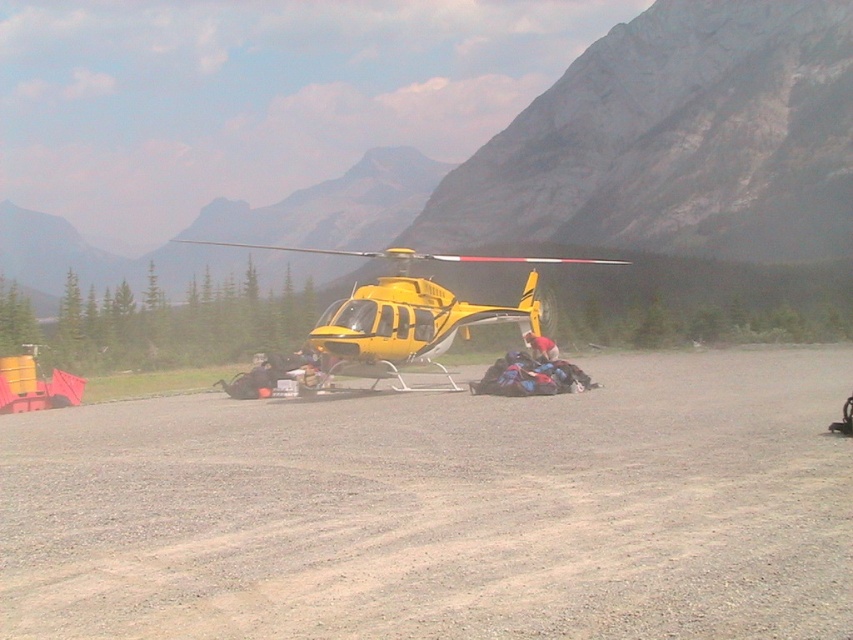
Measure the distance between gray gravel dirt track at center and camera.

They are 4.22 meters apart.

Which is in front, point (679, 525) or point (534, 356)?

Positioned in front is point (679, 525).

Identify the location of gray gravel dirt track at center. (444, 509).

Does rocky mountain at center have a greater height compared to red fabric bag at center?

Correct, rocky mountain at center is much taller as red fabric bag at center.

Between rocky mountain at center and red fabric bag at center, which one has more height?

rocky mountain at center

Who is more distant from viewer, (x=683, y=54) or (x=529, y=337)?

Point (x=683, y=54)

Find the location of a particular element. rocky mountain at center is located at coordinates (676, 141).

Is point (555, 376) positioned after point (537, 342)?

No, it is not.

Is blue fabric bags at center above red fabric bag at center?

No, blue fabric bags at center is not above red fabric bag at center.

Which is in front, point (567, 380) or point (550, 349)?

Point (567, 380)

Locate an element on the screen. This screenshot has width=853, height=640. blue fabric bags at center is located at coordinates (531, 378).